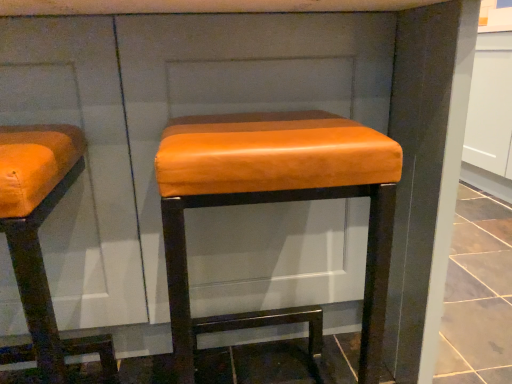
The image size is (512, 384). I want to click on empty space that is ontop of matte orange leather stool at center, so click(x=253, y=125).